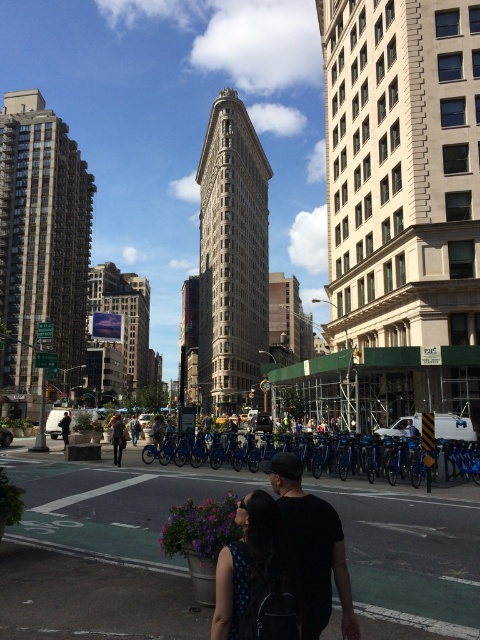
Is point (264, 556) closer to camera compared to point (66, 419)?

Yes, it is.

Image resolution: width=480 pixels, height=640 pixels. Describe the element at coordinates (254, 573) in the screenshot. I see `black fabric backpack at center` at that location.

Between point (233, 598) and point (69, 416), which one is positioned in front?

Point (233, 598) is more forward.

The height and width of the screenshot is (640, 480). What are the coordinates of `black fabric backpack at center` in the screenshot? It's located at (254, 573).

Between dark brown leather jacket at center and black leather jacket at left, which one appears on the right side from the viewer's perspective?

dark brown leather jacket at center

Does point (110, 426) come closer to viewer compared to point (63, 429)?

No, it is not.

Between point (120, 444) and point (66, 429), which one is positioned in front?

Point (120, 444)

You are a GUI agent. You are given a task and a screenshot of the screen. Output one action in this format:
    pyautogui.click(x=<x>, y=<y>)
    Task: Click on the dark brown leather jacket at center
    The image size is (480, 640).
    Given the screenshot: What is the action you would take?
    pyautogui.click(x=118, y=436)

The height and width of the screenshot is (640, 480). Describe the element at coordinates (312, 547) in the screenshot. I see `black matte shirt at center` at that location.

What do you see at coordinates (312, 547) in the screenshot? The height and width of the screenshot is (640, 480). I see `black matte shirt at center` at bounding box center [312, 547].

Where is `black matte shirt at center`? This screenshot has height=640, width=480. black matte shirt at center is located at coordinates (312, 547).